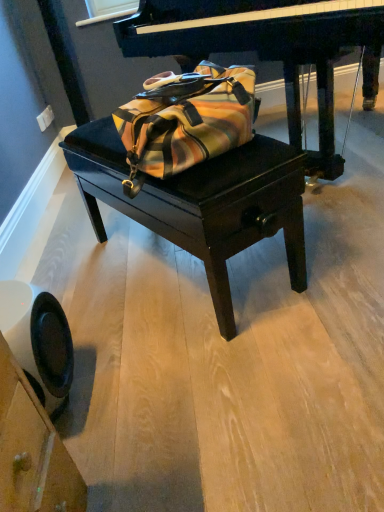
Locate an element on the screen. This screenshot has height=512, width=384. free space to the left of velvet black table at center is located at coordinates (84, 278).